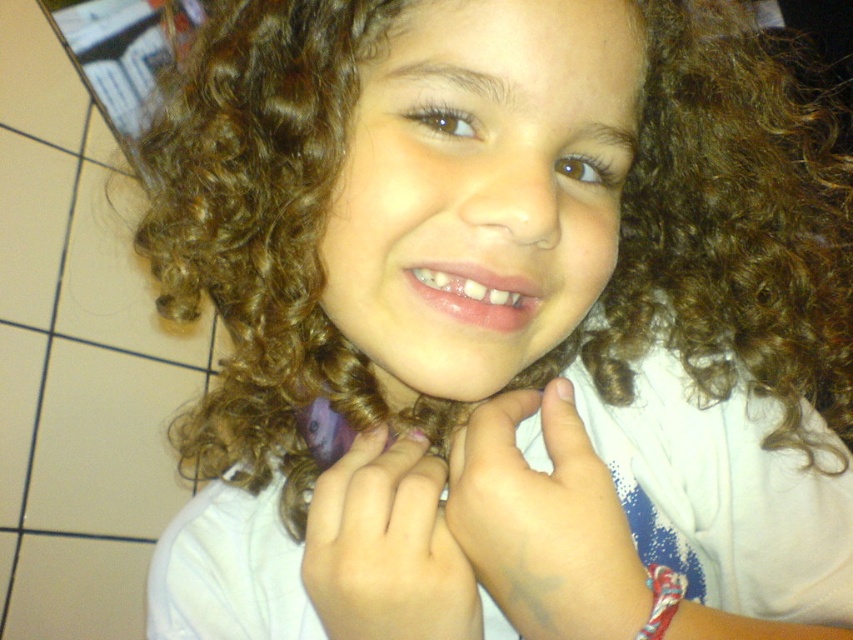
You are a photographer adjusting the lighting for a close portrait. You notice two hands near the child, a white matte hand at center and a smooth skin hand at center. Since the lighting needs to evenly illuminate both hands, which hand should you focus on adjusting the light for first, considering their distance apart?

The white matte hand at center is 1.39 inches away from smooth skin hand at center. To ensure even illumination, focus on adjusting the light for the white matte hand at center first since it might reflect light differently due to its matte surface compared to the smooth skin hand at center.

You are a photographer adjusting lighting for a closeup shot of a child. The scene includes a white matte hand at center and a smooth skin hand at center. Which hand should you focus on if you want to highlight the wider hand?

The white matte hand at center is wider than the smooth skin hand at center, so focusing on the white matte hand at center would highlight the wider hand.